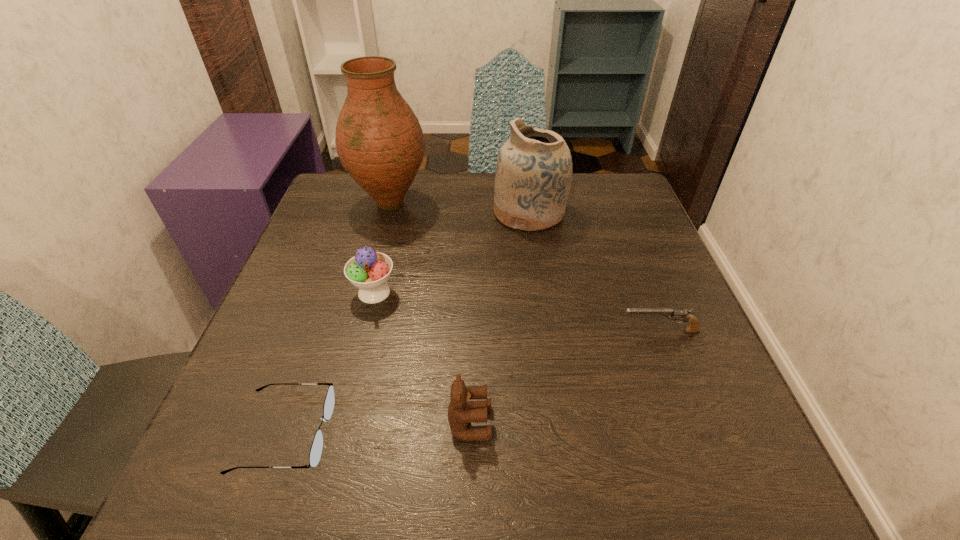
Where is `vase at the left edge`? Image resolution: width=960 pixels, height=540 pixels. vase at the left edge is located at coordinates (379, 141).

Where is `icecream present at the left edge`? icecream present at the left edge is located at coordinates click(x=368, y=270).

The image size is (960, 540). Find the location of `spectacles present at the left edge`. spectacles present at the left edge is located at coordinates (315, 454).

Locate an element on the screen. The width and height of the screenshot is (960, 540). object located in the right edge section of the desktop is located at coordinates (693, 327).

Locate an element on the screen. This screenshot has width=960, height=540. object that is at the far left corner is located at coordinates (379, 141).

Where is `object that is at the near left corner`? The width and height of the screenshot is (960, 540). object that is at the near left corner is located at coordinates (315, 454).

Find the location of a particular element. The width and height of the screenshot is (960, 540). free space at the far edge of the desktop is located at coordinates (432, 206).

This screenshot has height=540, width=960. In order to click on blank area at the near edge in this screenshot , I will do `click(613, 444)`.

The image size is (960, 540). Identify the location of free region at the left edge of the desktop. (341, 296).

This screenshot has height=540, width=960. I want to click on vacant space at the right edge, so click(x=652, y=256).